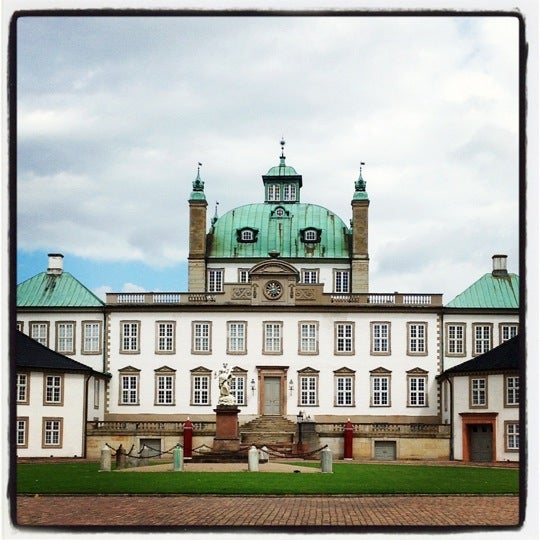
You are a GUI agent. You are given a task and a screenshot of the screen. Output one action in this format:
    pyautogui.click(x=<x>, y=<y>)
    Task: Click on the door
    The image size is (540, 540).
    Given the screenshot: What is the action you would take?
    pyautogui.click(x=274, y=394), pyautogui.click(x=474, y=431)